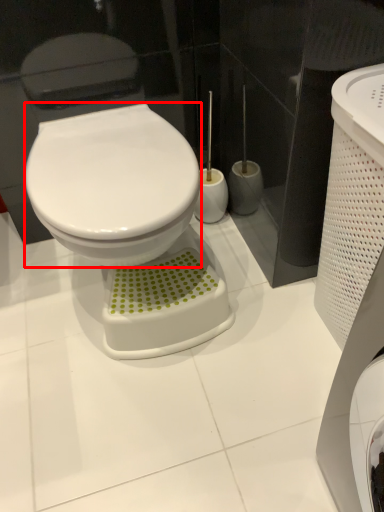
Question: Considering the relative positions of bidet (annotated by the red box) and porcelain in the image provided, where is bidet (annotated by the red box) located with respect to the staircase?

Choices:
 (A) right
 (B) left

Answer: (B)